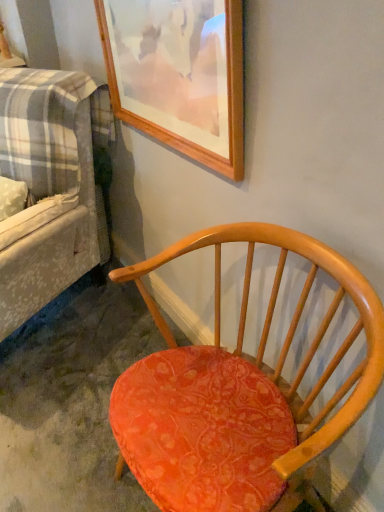
Question: Should I look upward or downward to see wooden picture frame at upper center?

Choices:
 (A) up
 (B) down

Answer: (A)

Question: From the image's perspective, is wooden picture frame at upper center located above plaid fabric couch at left?

Choices:
 (A) no
 (B) yes

Answer: (B)

Question: Could you tell me if wooden picture frame at upper center is facing plaid fabric couch at left?

Choices:
 (A) yes
 (B) no

Answer: (B)

Question: Is wooden picture frame at upper center turned away from plaid fabric couch at left?

Choices:
 (A) yes
 (B) no

Answer: (B)

Question: Can you confirm if wooden picture frame at upper center is thinner than plaid fabric couch at left?

Choices:
 (A) no
 (B) yes

Answer: (B)

Question: Considering the relative sizes of wooden picture frame at upper center and plaid fabric couch at left in the image provided, is wooden picture frame at upper center wider than plaid fabric couch at left?

Choices:
 (A) yes
 (B) no

Answer: (B)

Question: From a real-world perspective, does wooden picture frame at upper center stand above plaid fabric couch at left?

Choices:
 (A) yes
 (B) no

Answer: (A)

Question: Can you confirm if matte orange fabric chair at center is positioned to the right of wooden picture frame at upper center?

Choices:
 (A) no
 (B) yes

Answer: (B)

Question: Is matte orange fabric chair at center smaller than wooden picture frame at upper center?

Choices:
 (A) no
 (B) yes

Answer: (A)

Question: Are matte orange fabric chair at center and wooden picture frame at upper center making contact?

Choices:
 (A) yes
 (B) no

Answer: (B)

Question: Does matte orange fabric chair at center have a lesser width compared to wooden picture frame at upper center?

Choices:
 (A) no
 (B) yes

Answer: (A)

Question: Is matte orange fabric chair at center oriented towards wooden picture frame at upper center?

Choices:
 (A) no
 (B) yes

Answer: (A)

Question: Considering the relative sizes of matte orange fabric chair at center and wooden picture frame at upper center in the image provided, is matte orange fabric chair at center wider than wooden picture frame at upper center?

Choices:
 (A) yes
 (B) no

Answer: (A)

Question: Is plaid fabric couch at left closer to camera compared to wooden picture frame at upper center?

Choices:
 (A) no
 (B) yes

Answer: (A)